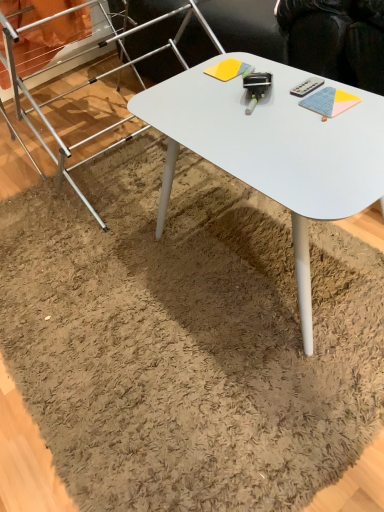
Where is `free location to the left of yellow matte notepad at center, which ranks as the second notepad in front-to-back order`? free location to the left of yellow matte notepad at center, which ranks as the second notepad in front-to-back order is located at coordinates (178, 88).